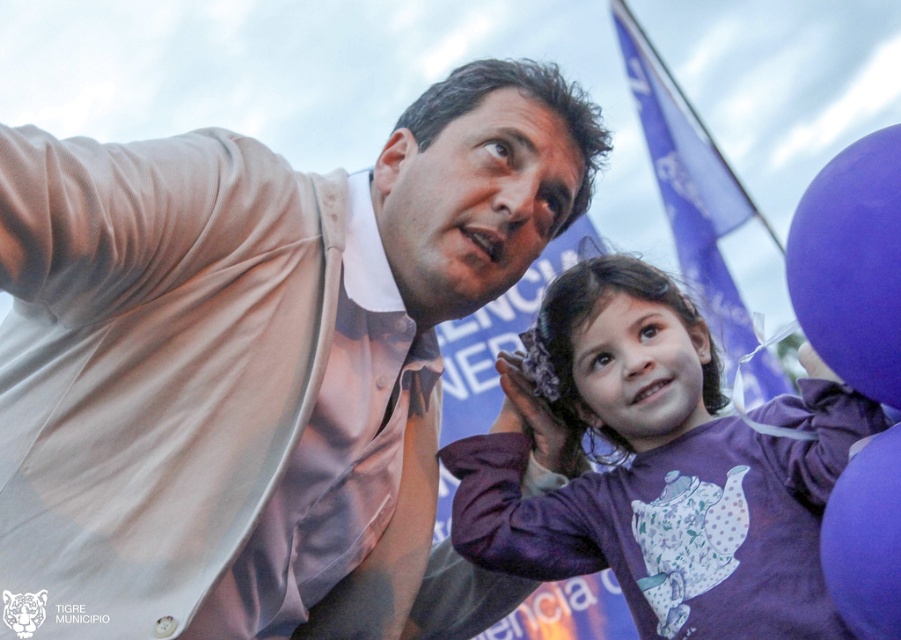
You are a photographer at the event and want to capture a photo where both the satin beige shirt at upper left and the purple matte balloon at right are clearly visible. However, you notice that one is blocking the view of the other. Which object is currently obscuring the other?

The purple matte balloon at right is behind the satin beige shirt at upper left, so the satin beige shirt at upper left is blocking the view of the purple matte balloon at right.

You are a photographer at the event and want to capture a photo that includes both the purple matte shirt at center and the purple fabric flag at upper right. Based on their positions, which object should appear to the left in the final photo?

The purple matte shirt at center should appear to the left of the purple fabric flag at upper right in the photo because it is positioned on the left side of the flag.

What is the object located at the coordinates point (259, 365)?

The object located at point (259, 365) is the satin beige shirt at upper left.